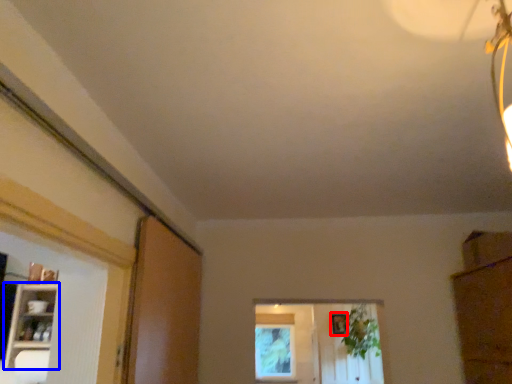
Question: Which object is further to the camera taking this photo, picture frame (highlighted by a red box) or shelf (highlighted by a blue box)?

Choices:
 (A) picture frame
 (B) shelf

Answer: (A)